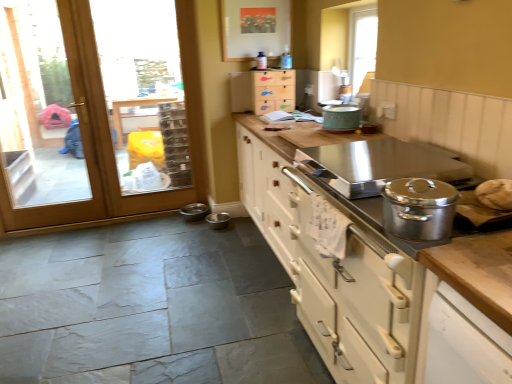
Where is `free space above wooden fish drawer at upper center, which is the 1th cabinetry from back to front (from a real-world perspective)`? The width and height of the screenshot is (512, 384). free space above wooden fish drawer at upper center, which is the 1th cabinetry from back to front (from a real-world perspective) is located at coordinates (274, 63).